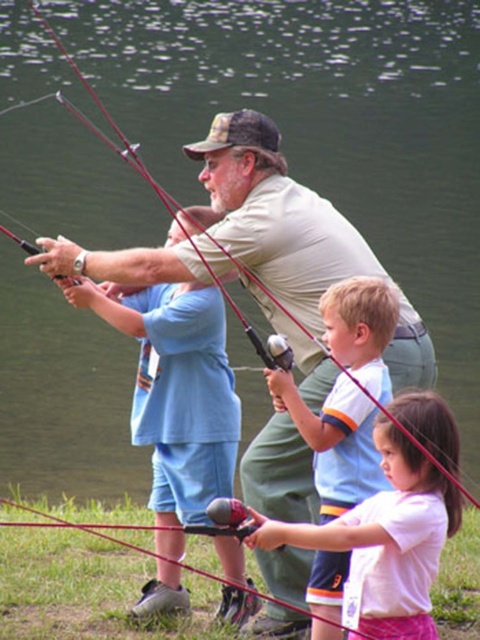
Question: Which is farther from the white cotton shirt at center?

Choices:
 (A) blue cotton shirt at center
 (B) white matte shirt at center

Answer: (A)

Question: From the image, what is the correct spatial relationship of white matte shirt at center in relation to white cotton shirt at center?

Choices:
 (A) above
 (B) below

Answer: (B)

Question: In this image, where is blue cotton shirt at center located relative to white cotton shirt at center?

Choices:
 (A) left
 (B) right

Answer: (A)

Question: Is blue cotton shirt at center above white matte shirt at center?

Choices:
 (A) yes
 (B) no

Answer: (A)

Question: Which object is the farthest from the white cotton shirt at center?

Choices:
 (A) white matte shirt at center
 (B) blue cotton shirt at center

Answer: (B)

Question: Which object appears closest to the camera in this image?

Choices:
 (A) blue cotton shirt at center
 (B) white matte shirt at center
 (C) white cotton shirt at center

Answer: (B)